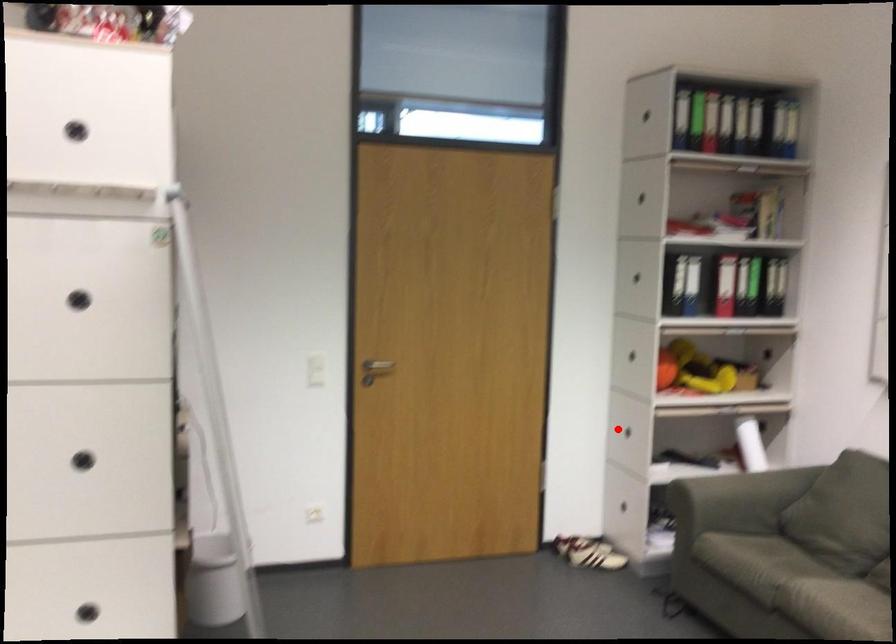
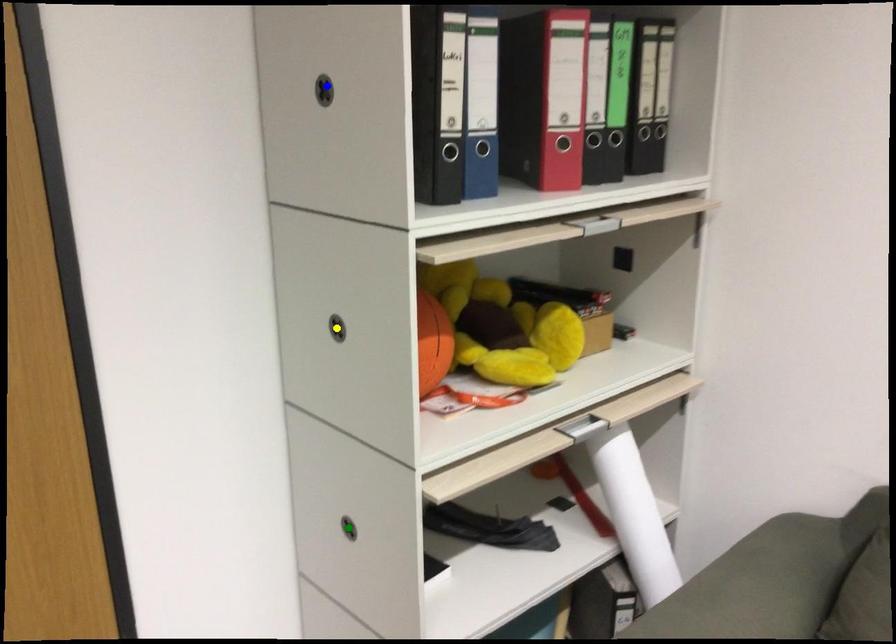
Question: I am providing you with two images of the same scene from different viewpoints. A red point is marked on the first image. You are given multiple points on the second image. Which mark in image 2 goes with the point in image 1?

Choices:
 (A) green point
 (B) yellow point
 (C) blue point

Answer: (A)